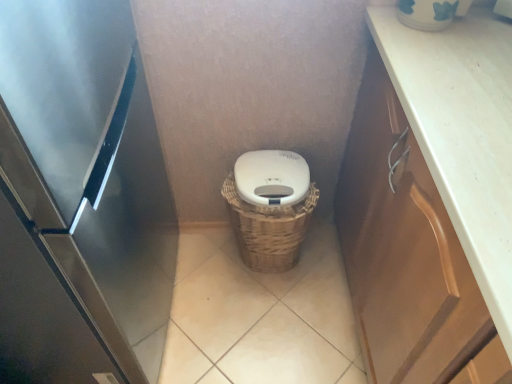
What do you see at coordinates (269, 229) in the screenshot?
I see `woven brown basket at center` at bounding box center [269, 229].

This screenshot has height=384, width=512. In order to click on white matte lid at center in this screenshot , I will do `click(271, 177)`.

Identify the location of brown wood cabinet at right. (425, 197).

From the image's perspective, does woven brown basket at center appear lower than stainless steel refrigerator at left?

Correct, woven brown basket at center appears lower than stainless steel refrigerator at left in the image.

Find the location of a particular element. appliance lying in front of the woven brown basket at center is located at coordinates (92, 163).

Does woven brown basket at center have a lesser width compared to stainless steel refrigerator at left?

Indeed, woven brown basket at center has a lesser width compared to stainless steel refrigerator at left.

Does woven brown basket at center touch stainless steel refrigerator at left?

woven brown basket at center is not next to stainless steel refrigerator at left, and they're not touching.

Which of these two, woven brown basket at center or beige tile at center, is bigger?

beige tile at center is bigger.

Which is closer, (x=278, y=256) or (x=229, y=230)?

Point (x=278, y=256) appears to be closer to the viewer than point (x=229, y=230).

Does woven brown basket at center contain beige tile at center?

No, beige tile at center is not a part of woven brown basket at center.

Is the surface of woven brown basket at center in direct contact with beige tile at center?

No, woven brown basket at center is not in contact with beige tile at center.

The image size is (512, 384). Find the location of `tile that appears below the stainless steel refrigerator at left (from a real-world perspective)`. tile that appears below the stainless steel refrigerator at left (from a real-world perspective) is located at coordinates (260, 316).

Which of these two, stainless steel refrigerator at left or beige tile at center, stands shorter?

With less height is beige tile at center.

Who is bigger, stainless steel refrigerator at left or beige tile at center?

stainless steel refrigerator at left is bigger.

Is stainless steel refrigerator at left oriented away from beige tile at center?

stainless steel refrigerator at left does not have its back to beige tile at center.

Is white matte lid at center in contact with stainless steel refrigerator at left?

No, white matte lid at center is not beside stainless steel refrigerator at left.

Between white matte lid at center and stainless steel refrigerator at left, which one has larger width?

With larger width is stainless steel refrigerator at left.

Which object is more forward, white matte lid at center or stainless steel refrigerator at left?

stainless steel refrigerator at left.

Considering the relative positions of white matte lid at center and stainless steel refrigerator at left in the image provided, is white matte lid at center to the left or to the right of stainless steel refrigerator at left?

Based on their positions, white matte lid at center is located to the right of stainless steel refrigerator at left.

Is brown wood cabinet at right looking in the opposite direction of white matte lid at center?

No.

Is brown wood cabinet at right touching white matte lid at center?

No, brown wood cabinet at right is not touching white matte lid at center.

Between brown wood cabinet at right and white matte lid at center, which one has more height?

brown wood cabinet at right is taller.

Does brown wood cabinet at right have a greater width compared to white matte lid at center?

Yes.

Is brown wood cabinet at right oriented away from woven brown basket at center?

No, woven brown basket at center is not at the back of brown wood cabinet at right.

Considering the sizes of objects brown wood cabinet at right and woven brown basket at center in the image provided, who is wider, brown wood cabinet at right or woven brown basket at center?

Wider between the two is brown wood cabinet at right.

This screenshot has height=384, width=512. I want to click on basket above the brown wood cabinet at right (from the image's perspective), so click(x=269, y=229).

Can you confirm if brown wood cabinet at right is shorter than woven brown basket at center?

In fact, brown wood cabinet at right may be taller than woven brown basket at center.

Considering the sizes of objects beige tile at center and brown wood cabinet at right in the image provided, who is smaller, beige tile at center or brown wood cabinet at right?

Smaller between the two is beige tile at center.

From the image's perspective, would you say beige tile at center is shown under brown wood cabinet at right?

Indeed, from the image's perspective, beige tile at center is shown beneath brown wood cabinet at right.

How distant is beige tile at center from brown wood cabinet at right?

The distance of beige tile at center from brown wood cabinet at right is 21.98 inches.

You are a GUI agent. You are given a task and a screenshot of the screen. Output one action in this format:
    pyautogui.click(x=<x>, y=<y>)
    Task: Click on the basket behind the stainless steel refrigerator at left
    The width and height of the screenshot is (512, 384).
    Given the screenshot: What is the action you would take?
    pyautogui.click(x=269, y=229)

Locate an element on the screen. The height and width of the screenshot is (384, 512). tile that appears on the left of woven brown basket at center is located at coordinates (260, 316).

Consider the image. When comparing their distances from woven brown basket at center, does beige tile at center or white matte lid at center seem closer?

white matte lid at center.

From the image, which object appears to be farther from beige tile at center, stainless steel refrigerator at left or white matte lid at center?

Among the two, white matte lid at center is located further to beige tile at center.

Estimate the real-world distances between objects in this image. Which object is closer to brown wood cabinet at right, white matte lid at center or stainless steel refrigerator at left?

Among the two, white matte lid at center is located nearer to brown wood cabinet at right.

Based on their spatial positions, is stainless steel refrigerator at left or white matte lid at center closer to brown wood cabinet at right?

Based on the image, white matte lid at center appears to be nearer to brown wood cabinet at right.

From the picture: From the image, which object appears to be nearer to woven brown basket at center, white matte lid at center or stainless steel refrigerator at left?

white matte lid at center lies closer to woven brown basket at center than the other object.

When comparing their distances from beige tile at center, does brown wood cabinet at right or white matte lid at center seem closer?

The object closer to beige tile at center is white matte lid at center.

When comparing their distances from brown wood cabinet at right, does beige tile at center or stainless steel refrigerator at left seem further?

stainless steel refrigerator at left is further to brown wood cabinet at right.

When comparing their distances from white matte lid at center, does brown wood cabinet at right or woven brown basket at center seem closer?

woven brown basket at center lies closer to white matte lid at center than the other object.

I want to click on lid between stainless steel refrigerator at left and brown wood cabinet at right in the horizontal direction, so click(x=271, y=177).

At what (x,y) coordinates should I click in order to perform the action: click on tile located between stainless steel refrigerator at left and woven brown basket at center in the depth direction. Please return your answer as a coordinate pair (x, y). The height and width of the screenshot is (384, 512). Looking at the image, I should click on (260, 316).

Identify the location of tile between brown wood cabinet at right and woven brown basket at center along the z-axis. The image size is (512, 384). (260, 316).

I want to click on basket between stainless steel refrigerator at left and brown wood cabinet at right, so click(x=269, y=229).